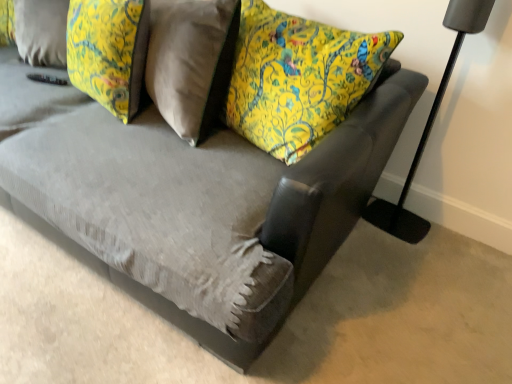
In order to click on yellow floral fabric pillow at upper left in this screenshot , I will do `click(109, 51)`.

The image size is (512, 384). What do you see at coordinates (109, 51) in the screenshot? I see `yellow floral fabric pillow at upper left` at bounding box center [109, 51].

What do you see at coordinates (429, 126) in the screenshot? Image resolution: width=512 pixels, height=384 pixels. I see `matte black floor lamp at right` at bounding box center [429, 126].

Locate an element on the screen. The height and width of the screenshot is (384, 512). matte black floor lamp at right is located at coordinates (429, 126).

Based on the photo, measure the distance between matte black floor lamp at right and camera.

matte black floor lamp at right is 1.39 meters from camera.

You are a GUI agent. You are given a task and a screenshot of the screen. Output one action in this format:
    pyautogui.click(x=<x>, y=<y>)
    Task: Click on the yellow floral fabric pillow at upper left
    This screenshot has height=384, width=512.
    Given the screenshot: What is the action you would take?
    pyautogui.click(x=109, y=51)

Which is more to the left, yellow floral fabric pillow at upper left or matte black floor lamp at right?

yellow floral fabric pillow at upper left is more to the left.

Is yellow floral fabric pillow at upper left positioned in front of matte black floor lamp at right?

No, yellow floral fabric pillow at upper left is further to the viewer.

Between point (90, 50) and point (444, 75), which one is positioned behind?

The point (444, 75) is farther.

From the image's perspective, would you say yellow floral fabric pillow at upper left is shown under matte black floor lamp at right?

No, from the image's perspective, yellow floral fabric pillow at upper left is not below matte black floor lamp at right.

From a real-world perspective, is yellow floral fabric pillow at upper left below matte black floor lamp at right?

No, from a real-world perspective, yellow floral fabric pillow at upper left is not under matte black floor lamp at right.

In terms of width, does yellow floral fabric pillow at upper left look wider or thinner when compared to matte black floor lamp at right?

yellow floral fabric pillow at upper left is wider than matte black floor lamp at right.

Considering the sizes of objects yellow floral fabric pillow at upper left and matte black floor lamp at right in the image provided, who is shorter, yellow floral fabric pillow at upper left or matte black floor lamp at right?

yellow floral fabric pillow at upper left.

Based on their sizes in the image, would you say yellow floral fabric pillow at upper left is bigger or smaller than matte black floor lamp at right?

Considering their sizes, yellow floral fabric pillow at upper left takes up more space than matte black floor lamp at right.

From the picture: Is yellow floral fabric pillow at upper left spatially inside matte black floor lamp at right, or outside of it?

The correct answer is: outside.

Would you say yellow floral fabric pillow at upper left is a long distance from matte black floor lamp at right?

Yes, yellow floral fabric pillow at upper left and matte black floor lamp at right are located far from each other.

Could you tell me if yellow floral fabric pillow at upper left is facing matte black floor lamp at right?

No, yellow floral fabric pillow at upper left does not turn towards matte black floor lamp at right.

How different are the orientations of yellow floral fabric pillow at upper left and matte black floor lamp at right in degrees?

There is a 12.4-degree angle between the facing directions of yellow floral fabric pillow at upper left and matte black floor lamp at right.

Identify the location of pillow above the matte black floor lamp at right (from a real-world perspective). (109, 51).

Based on the photo, would you say matte black floor lamp at right is to the left or to the right of yellow floral fabric pillow at upper left in the picture?

matte black floor lamp at right is positioned on yellow floral fabric pillow at upper left's right side.

Which object is more forward, matte black floor lamp at right or yellow floral fabric pillow at upper left?

matte black floor lamp at right is closer to the camera.

Is point (413, 173) positioned before point (132, 37)?

No, (413, 173) is behind (132, 37).

From the image's perspective, between matte black floor lamp at right and yellow floral fabric pillow at upper left, which one is located above?

yellow floral fabric pillow at upper left, from the image's perspective.

From a real-world perspective, is matte black floor lamp at right over yellow floral fabric pillow at upper left?

Incorrect, from a real-world perspective, matte black floor lamp at right is lower than yellow floral fabric pillow at upper left.

Can you confirm if matte black floor lamp at right is thinner than yellow floral fabric pillow at upper left?

Indeed, matte black floor lamp at right has a lesser width compared to yellow floral fabric pillow at upper left.

Considering the relative sizes of matte black floor lamp at right and yellow floral fabric pillow at upper left in the image provided, is matte black floor lamp at right taller than yellow floral fabric pillow at upper left?

Indeed, matte black floor lamp at right has a greater height compared to yellow floral fabric pillow at upper left.

Who is bigger, matte black floor lamp at right or yellow floral fabric pillow at upper left?

yellow floral fabric pillow at upper left is bigger.

Is yellow floral fabric pillow at upper left a part of matte black floor lamp at right?

No, yellow floral fabric pillow at upper left is not surrounded by matte black floor lamp at right.

Is matte black floor lamp at right touching yellow floral fabric pillow at upper left?

No.

Is matte black floor lamp at right oriented towards yellow floral fabric pillow at upper left?

No, matte black floor lamp at right is not turned towards yellow floral fabric pillow at upper left.

In the scene shown: What's the angular difference between matte black floor lamp at right and yellow floral fabric pillow at upper left's facing directions?

There is a 12.4-degree angle between the facing directions of matte black floor lamp at right and yellow floral fabric pillow at upper left.

Locate an element on the screen. The image size is (512, 384). pillow above the matte black floor lamp at right (from a real-world perspective) is located at coordinates (109, 51).

This screenshot has height=384, width=512. Find the location of `pillow behind the matte black floor lamp at right`. pillow behind the matte black floor lamp at right is located at coordinates (109, 51).

This screenshot has height=384, width=512. Identify the location of table lamp on the right side of yellow floral fabric pillow at upper left. (429, 126).